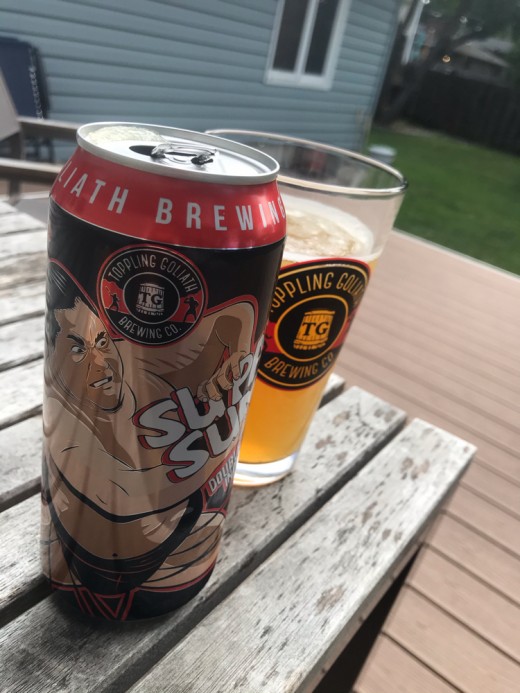
I want to click on wood table, so click(350, 527).